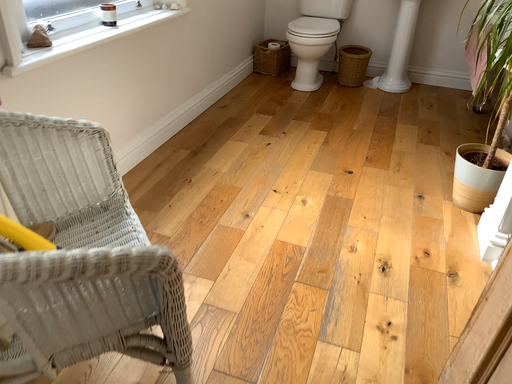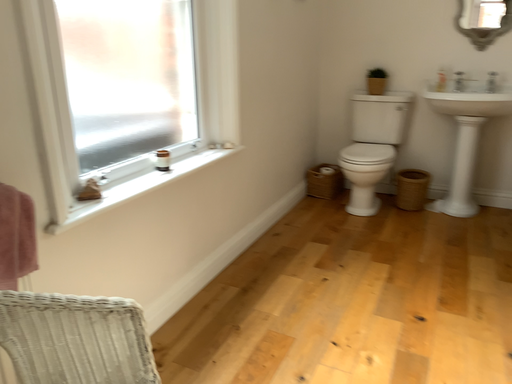
Question: Which way did the camera rotate in the video?

Choices:
 (A) rotated right
 (B) rotated left

Answer: (B)